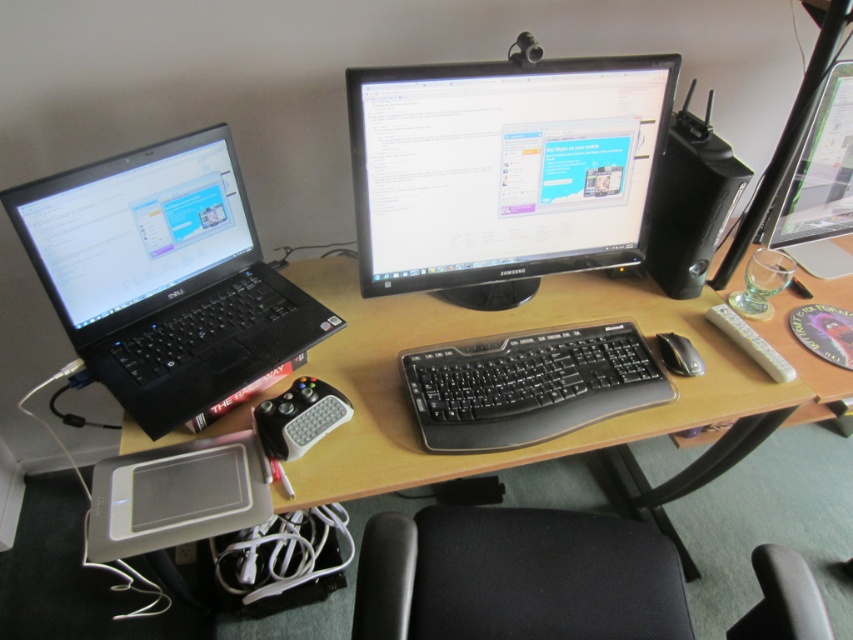
You are a delivery person standing at the entrance of the office. You need to place a new package on the desk without moving any existing items. The package is 0.8 meters wide. Is there enough space between the black Dell laptop and the black glossy monitor at center to place it?

The black glossy monitor at center is 1.07 meters from the camera. Since the package is 0.8 meters wide, there is sufficient space between the black Dell laptop and the black glossy monitor at center to place it.

You are a delivery person standing at the entrance of the office. You need to place a package on the desk without moving the black fabric swivel chair at lower center. Is there enough space between the chair and the desk edge to do this?

The black fabric swivel chair at lower center is 93.43 centimeters away from the viewer. Since the desk has enough space between the chair and its edge, the package can be placed there without moving the chair.

You are setting up a new monitor and need to ensure it fits on your desk. The new monitor is 10 cm thick. Based on the image, will the black glossy monitor at center fit on the wooden desk at center?

The black glossy monitor at center is thinner than the wooden desk at center, so it will fit since its thickness is less than the desk.